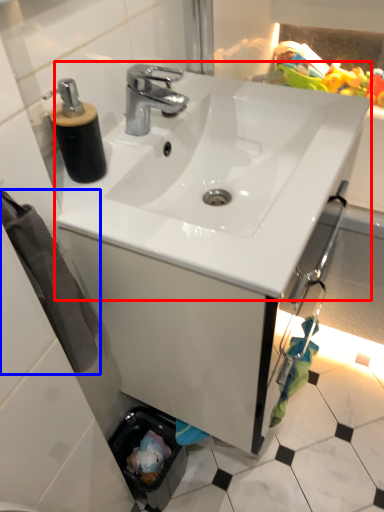
Question: Which object appears farthest to the camera in this image, sink (highlighted by a red box) or bath towel (highlighted by a blue box)?

Choices:
 (A) sink
 (B) bath towel

Answer: (A)